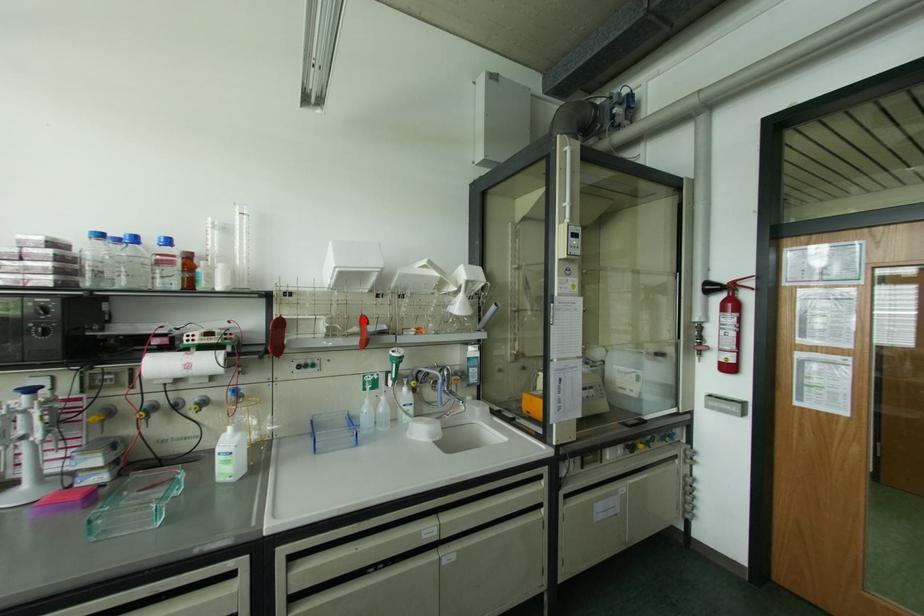
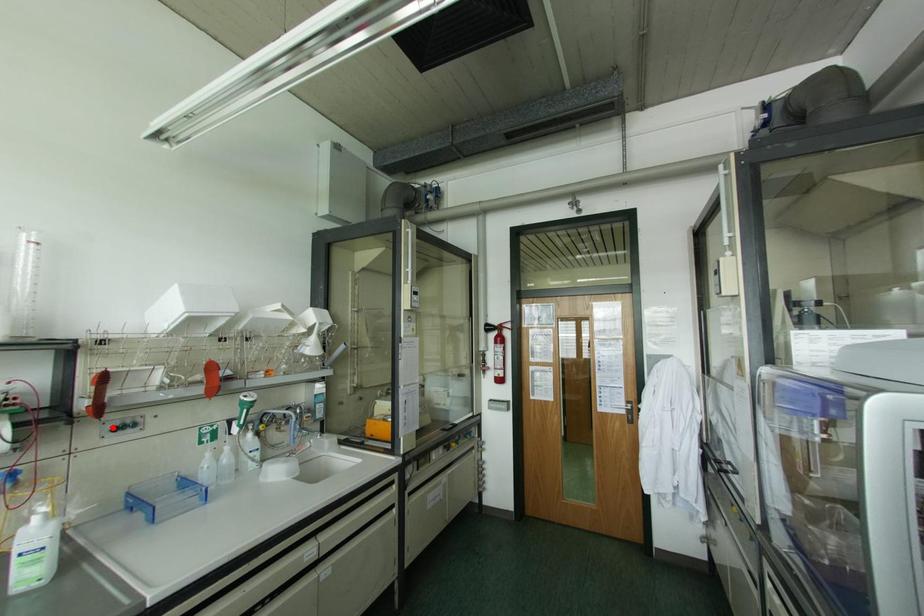
I am providing you with two images of the same scene from different viewpoints. A red point is marked on the first image and another point is marked on the second image. Does the point marked in image1 correspond to the same location as the one in image2?

No